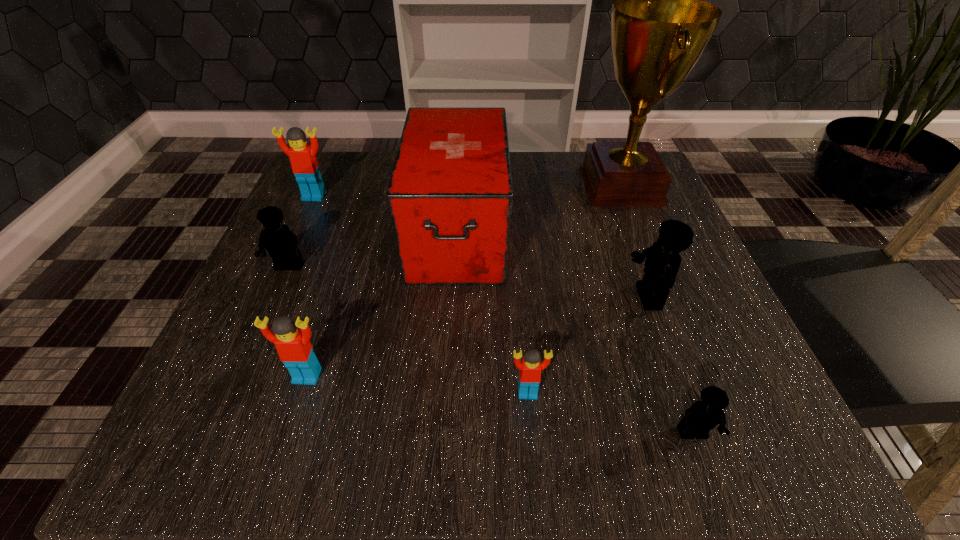
The width and height of the screenshot is (960, 540). In order to click on object present at the far left corner in this screenshot , I will do `click(305, 167)`.

Find the location of `object at the far right corner`. object at the far right corner is located at coordinates (660, 27).

In order to click on object located in the near right corner section of the desktop in this screenshot , I will do `click(702, 416)`.

The height and width of the screenshot is (540, 960). I want to click on blank space at the far edge of the desktop, so click(539, 167).

Where is `vacant space at the near edge`? The image size is (960, 540). vacant space at the near edge is located at coordinates (492, 440).

You are a GUI agent. You are given a task and a screenshot of the screen. Output one action in this format:
    pyautogui.click(x=<x>, y=<y>)
    Task: Click on the vacant area at the left edge
    This screenshot has height=540, width=960.
    Given the screenshot: What is the action you would take?
    pyautogui.click(x=334, y=312)

Where is `blank area at the right edge`? blank area at the right edge is located at coordinates (668, 334).

This screenshot has width=960, height=540. I want to click on free location at the far left corner, so click(330, 202).

At what (x,y) coordinates should I click in order to perform the action: click on blank space at the far right corner of the desktop. Please return your answer as a coordinate pair (x, y). The width and height of the screenshot is (960, 540). Looking at the image, I should click on (610, 211).

Identify the location of free space at the near right corner of the desktop. (660, 398).